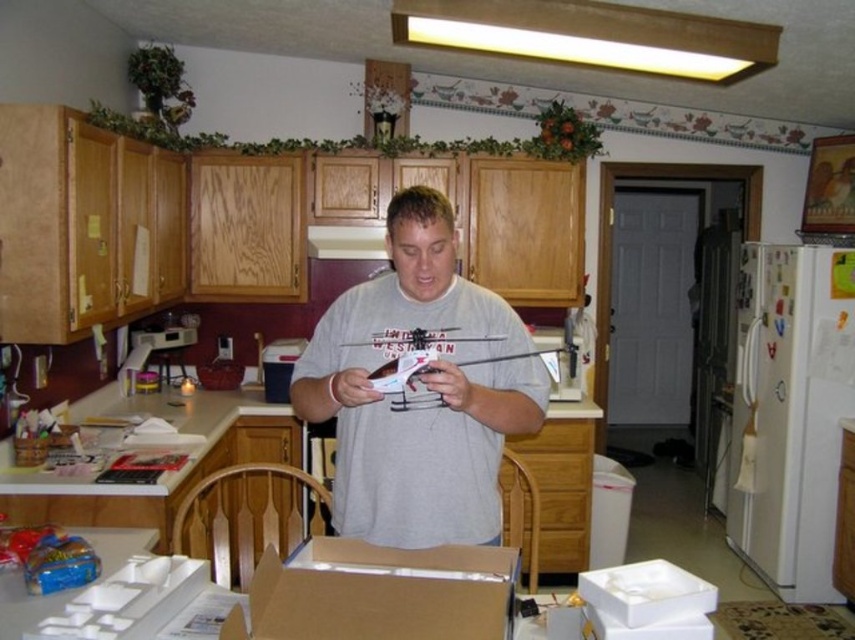
You are a kitchen designer planning to install a new appliance. You see the white matte box at lower right and the white glossy exhaust hood at upper center. Which object is closer to you from your current viewpoint?

The white matte box at lower right is closer to you because it is in front of the white glossy exhaust hood at upper center.

You are a new employee in a kitchen and need to locate the exhaust hood to vent smoke. You see the gray matte shirt at center and the white glossy exhaust hood at upper center. Which object is positioned higher in the image?

The white glossy exhaust hood at upper center is positioned higher than the gray matte shirt at center.

You are a kitchen designer planning to place a new appliance that requires 2 meters of width. You see the white matte box at lower right and the white glossy exhaust hood at upper center. Which object can accommodate the appliance based on their widths?

The white glossy exhaust hood at upper center has a greater width than the white matte box at lower right, so it can accommodate the appliance requiring 2 meters of width.